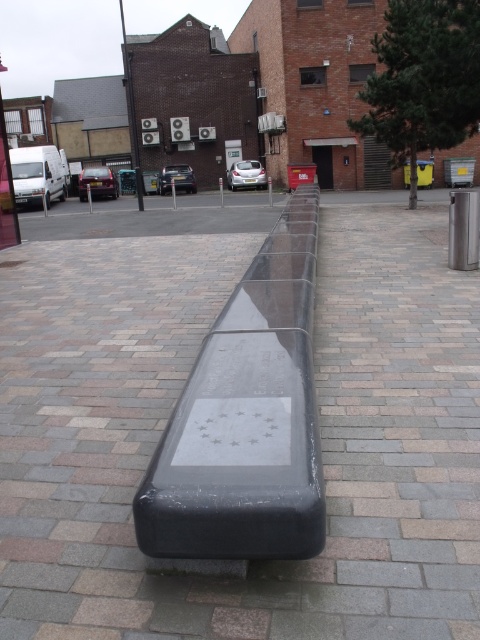
You are a person with a height of 1.7 meters standing in front of the black polished bench at center and the black polished stone bench at center. Which bench would you find taller?

The black polished bench at center is taller than the black polished stone bench at center.

You are a city planner who needs to install a new streetlight between the black polished bench at center and the black polished stone bench at center. The streetlight requires a minimum of 6 meters of space to be installed safely. Based on the scene, can the streetlight be placed between these two benches?

The black polished bench at center and the black polished stone bench at center are 5.77 meters apart, which is less than the required 6 meters for the streetlight installation. Therefore, the streetlight cannot be safely placed between them.

You are a city planner reviewing the layout of the urban space. You notice the black polished bench at center and the black polished stone bench at center. Which bench is placed on top of the other?

The black polished bench at center is positioned over the black polished stone bench at center.